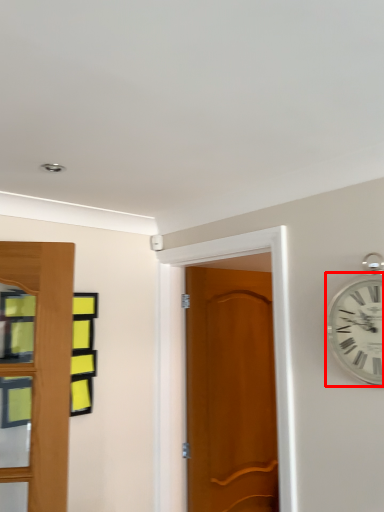
Question: From the image's perspective, what is the correct spatial positioning of wall clock (annotated by the red box) in reference to door?

Choices:
 (A) below
 (B) above

Answer: (B)